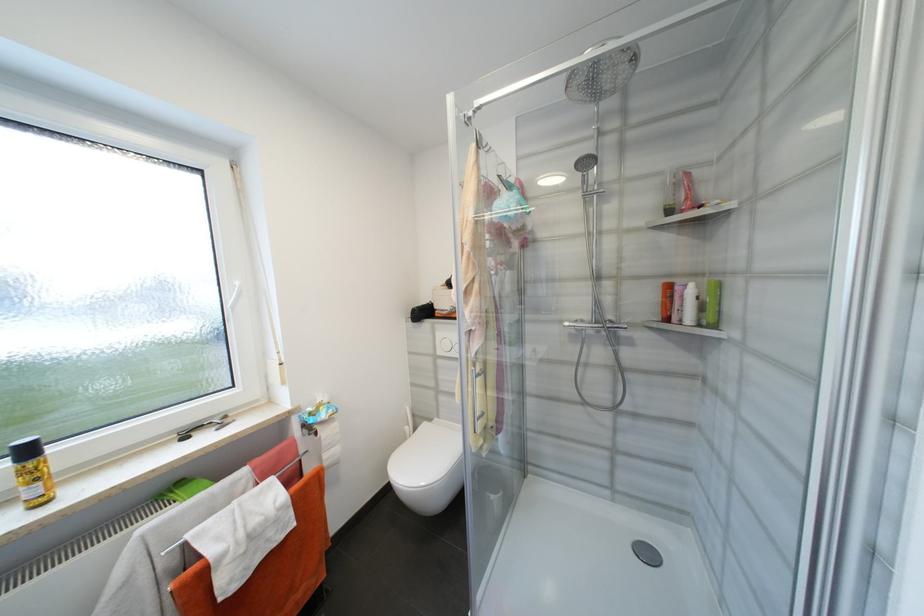
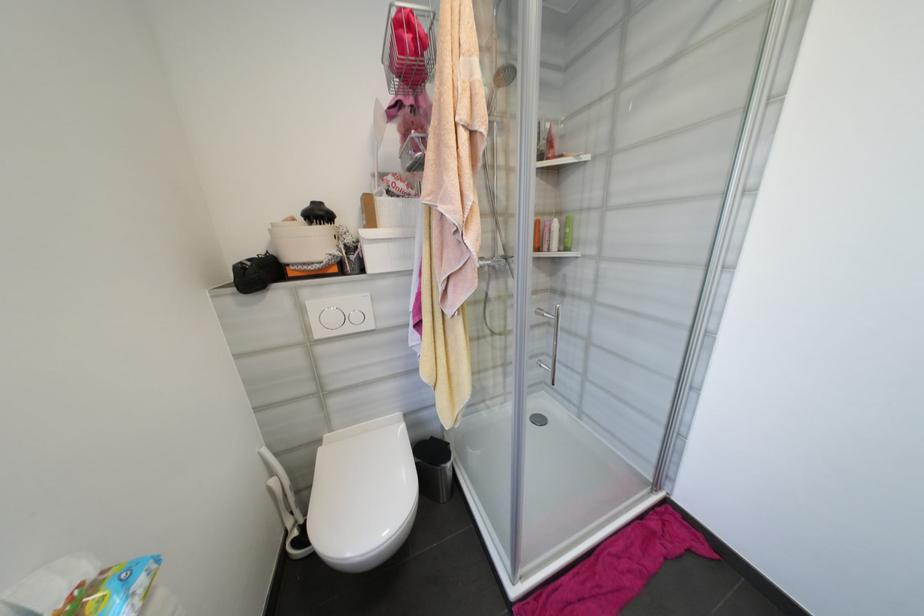
Where in the second image is the point corresponding to [412,429] from the first image?

(277, 482)